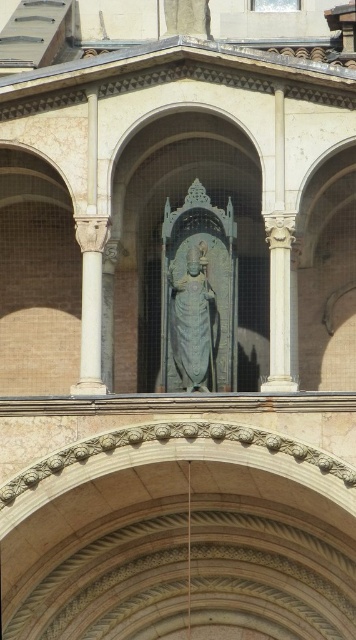
Can you confirm if gray stone statue at center is wider than white marble column at right?

Incorrect, gray stone statue at center's width does not surpass white marble column at right's.

Locate an element on the screen. This screenshot has height=640, width=356. gray stone statue at center is located at coordinates (190, 321).